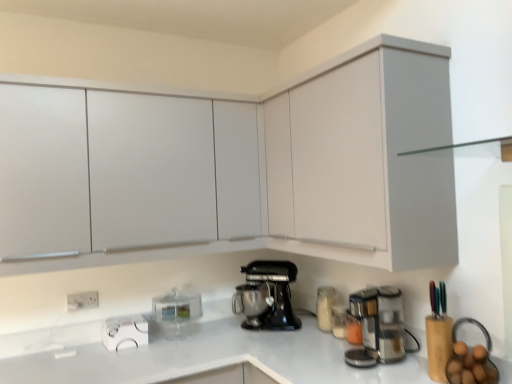
What do you see at coordinates (82, 300) in the screenshot? I see `white plastic electric outlet at lower left` at bounding box center [82, 300].

The height and width of the screenshot is (384, 512). Describe the element at coordinates (119, 175) in the screenshot. I see `white matte cabinet at upper left, the first cabinetry from the back` at that location.

What is the approximate width of black matte stand mixer at center, which ranks as the second kitchen appliance in left-to-right order?

It is 12.92 inches.

This screenshot has width=512, height=384. I want to click on stainless steel coffee maker at lower right, so click(380, 327).

What is the approximate width of white matte cabinet at upper right, which is counted as the 2th cabinetry, starting from the back?

white matte cabinet at upper right, which is counted as the 2th cabinetry, starting from the back, is 14.37 inches in width.

Where is `white matte cabinet at upper right, which is counted as the 2th cabinetry, starting from the back`? white matte cabinet at upper right, which is counted as the 2th cabinetry, starting from the back is located at coordinates (371, 154).

This screenshot has height=384, width=512. In order to click on matte white cabinet at upper center, which appears as the 1th cabinetry when viewed from the front in this screenshot , I will do `click(240, 169)`.

In the scene shown: Is stainless steel coffee maker at lower right positioned with its back to matte white cabinet at upper center, which appears as the 1th cabinetry when viewed from the front?

No, matte white cabinet at upper center, which appears as the 1th cabinetry when viewed from the front, is not at the back of stainless steel coffee maker at lower right.

In the scene shown: Which object is further away from the camera, stainless steel coffee maker at lower right or matte white cabinet at upper center, which is the 3th cabinetry from back to front?

stainless steel coffee maker at lower right.

Can you tell me how much stainless steel coffee maker at lower right and matte white cabinet at upper center, which appears as the 1th cabinetry when viewed from the front, differ in facing direction?

There is a 91.8-degree angle between the facing directions of stainless steel coffee maker at lower right and matte white cabinet at upper center, which appears as the 1th cabinetry when viewed from the front.

Is white matte cabinet at upper right, the second cabinetry when ordered from front to back, positioned with its back to white plastic electric outlet at lower left?

No, white matte cabinet at upper right, the second cabinetry when ordered from front to back, is not facing the opposite direction of white plastic electric outlet at lower left.

From a real-world perspective, is white matte cabinet at upper right, which is counted as the 2th cabinetry, starting from the back, on top of white plastic electric outlet at lower left?

Indeed, from a real-world perspective, white matte cabinet at upper right, which is counted as the 2th cabinetry, starting from the back, stands above white plastic electric outlet at lower left.

From the picture: Considering the sizes of objects white matte cabinet at upper right, the second cabinetry when ordered from front to back, and white plastic electric outlet at lower left in the image provided, who is smaller, white matte cabinet at upper right, the second cabinetry when ordered from front to back, or white plastic electric outlet at lower left?

With smaller size is white plastic electric outlet at lower left.

From the image's perspective, is white matte cabinet at upper right, the second cabinetry when ordered from front to back, positioned above or below white plastic electric outlet at lower left?

white matte cabinet at upper right, the second cabinetry when ordered from front to back, is situated higher than white plastic electric outlet at lower left in the image.

Consider the image. Is matte white cabinet at upper center, which is the 3th cabinetry from back to front, not inside white matte cabinet at upper left, which is counted as the third cabinetry, starting from the front?

matte white cabinet at upper center, which is the 3th cabinetry from back to front, lies outside white matte cabinet at upper left, which is counted as the third cabinetry, starting from the front,'s area.

From a real-world perspective, is matte white cabinet at upper center, which appears as the 1th cabinetry when viewed from the front, positioned above or below white matte cabinet at upper left, the first cabinetry from the back?

matte white cabinet at upper center, which appears as the 1th cabinetry when viewed from the front, is situated higher than white matte cabinet at upper left, the first cabinetry from the back, in the real world.

From their relative heights in the image, would you say matte white cabinet at upper center, which is the 3th cabinetry from back to front, is taller or shorter than white matte cabinet at upper left, which is counted as the third cabinetry, starting from the front?

matte white cabinet at upper center, which is the 3th cabinetry from back to front, is taller than white matte cabinet at upper left, which is counted as the third cabinetry, starting from the front.

Is white plastic electric outlet at lower left far from white matte cabinet at upper left, the first cabinetry from the back?

That's not correct — white plastic electric outlet at lower left is a little close to white matte cabinet at upper left, the first cabinetry from the back.

Who is bigger, white plastic electric outlet at lower left or white matte cabinet at upper left, which is counted as the third cabinetry, starting from the front?

With larger size is white matte cabinet at upper left, which is counted as the third cabinetry, starting from the front.

Which of these two, white plastic electric outlet at lower left or white matte cabinet at upper left, the first cabinetry from the back, stands taller?

Standing taller between the two is white matte cabinet at upper left, the first cabinetry from the back.

Is white plastic electric outlet at lower left facing towards white matte cabinet at upper left, the first cabinetry from the back?

No, white plastic electric outlet at lower left is not aimed at white matte cabinet at upper left, the first cabinetry from the back.

Between point (394, 314) and point (257, 296), which one is positioned behind?

The point (257, 296) is farther.

Which of these two, stainless steel coffee maker at lower right or black matte stand mixer at center, the first kitchen appliance viewed from the right, is thinner?

Thinner between the two is stainless steel coffee maker at lower right.

Would you say stainless steel coffee maker at lower right is outside black matte stand mixer at center, the first kitchen appliance viewed from the right?

That's correct, stainless steel coffee maker at lower right is outside of black matte stand mixer at center, the first kitchen appliance viewed from the right.

Are white matte cabinet at upper right, the second cabinetry when ordered from front to back, and black matte stand mixer at center, the first kitchen appliance viewed from the right, far apart?

No, white matte cabinet at upper right, the second cabinetry when ordered from front to back, is not far away from black matte stand mixer at center, the first kitchen appliance viewed from the right.

Who is more distant, white matte cabinet at upper right, the second cabinetry when ordered from front to back, or black matte stand mixer at center, which ranks as the second kitchen appliance in left-to-right order?

black matte stand mixer at center, which ranks as the second kitchen appliance in left-to-right order.

From the image's perspective, between white matte cabinet at upper right, the second cabinetry when ordered from front to back, and black matte stand mixer at center, which ranks as the second kitchen appliance in left-to-right order, who is located below?

black matte stand mixer at center, which ranks as the second kitchen appliance in left-to-right order, appears lower in the image.

Do you think white matte cabinet at upper right, the second cabinetry when ordered from front to back, is within black matte stand mixer at center, which ranks as the second kitchen appliance in left-to-right order, or outside of it?

white matte cabinet at upper right, the second cabinetry when ordered from front to back, cannot be found inside black matte stand mixer at center, which ranks as the second kitchen appliance in left-to-right order.

Which of these two, white plastic electric outlet at lower left or matte white cabinet at upper center, which is the 3th cabinetry from back to front, is bigger?

matte white cabinet at upper center, which is the 3th cabinetry from back to front, is bigger.

How many degrees apart are the facing directions of white plastic electric outlet at lower left and matte white cabinet at upper center, which appears as the 1th cabinetry when viewed from the front?

The facing directions of white plastic electric outlet at lower left and matte white cabinet at upper center, which appears as the 1th cabinetry when viewed from the front, are 0.145 degrees apart.

Is white plastic electric outlet at lower left aimed at matte white cabinet at upper center, which is the 3th cabinetry from back to front?

No, white plastic electric outlet at lower left is not facing towards matte white cabinet at upper center, which is the 3th cabinetry from back to front.

Is white plastic electric outlet at lower left shorter than matte white cabinet at upper center, which appears as the 1th cabinetry when viewed from the front?

Yes, white plastic electric outlet at lower left is shorter than matte white cabinet at upper center, which appears as the 1th cabinetry when viewed from the front.

Find the location of a particular element. The height and width of the screenshot is (384, 512). home appliance on the right of the matte white cabinet at upper center, which is the 3th cabinetry from back to front is located at coordinates (380, 327).

Image resolution: width=512 pixels, height=384 pixels. I want to click on the 2nd cabinetry in front of the white plastic electric outlet at lower left, counting from the anchor's position, so click(371, 154).

Which object lies further to the anchor point transparent plastic container at center, which is the first kitchen appliance from left to right, white matte cabinet at upper left, the first cabinetry from the back, or white matte cabinet at upper right, which is counted as the 2th cabinetry, starting from the back?

Among the two, white matte cabinet at upper right, which is counted as the 2th cabinetry, starting from the back, is located further to transparent plastic container at center, which is the first kitchen appliance from left to right.

Estimate the real-world distances between objects in this image. Which object is further from white plastic electric outlet at lower left, white matte cabinet at upper right, which is counted as the 2th cabinetry, starting from the back, or black matte stand mixer at center, which ranks as the second kitchen appliance in left-to-right order?

white matte cabinet at upper right, which is counted as the 2th cabinetry, starting from the back, is positioned further to the anchor white plastic electric outlet at lower left.

Which object lies nearer to the anchor point stainless steel coffee maker at lower right, white matte cabinet at upper right, which is counted as the 2th cabinetry, starting from the back, or black matte stand mixer at center, the first kitchen appliance viewed from the right?

black matte stand mixer at center, the first kitchen appliance viewed from the right.

Based on the photo, when comparing their distances from transparent plastic container at center, which is the first kitchen appliance from left to right, does stainless steel coffee maker at lower right or white glossy kettle at lower left seem closer?

The object closer to transparent plastic container at center, which is the first kitchen appliance from left to right, is white glossy kettle at lower left.

From the image, which object appears to be nearer to black matte stand mixer at center, the first kitchen appliance viewed from the right, white plastic electric outlet at lower left or white matte cabinet at upper right, which is counted as the 2th cabinetry, starting from the back?

white matte cabinet at upper right, which is counted as the 2th cabinetry, starting from the back, is positioned closer to the anchor black matte stand mixer at center, the first kitchen appliance viewed from the right.

Considering their positions, is white matte cabinet at upper right, the second cabinetry when ordered from front to back, positioned closer to transparent plastic container at center, positioned as the 2th kitchen appliance in right-to-left order, than matte white cabinet at upper center, which appears as the 1th cabinetry when viewed from the front?

Based on the image, matte white cabinet at upper center, which appears as the 1th cabinetry when viewed from the front, appears to be nearer to transparent plastic container at center, positioned as the 2th kitchen appliance in right-to-left order.

Looking at this image, based on their spatial positions, is matte white cabinet at upper center, which is the 3th cabinetry from back to front, or black matte stand mixer at center, the first kitchen appliance viewed from the right, closer to white matte cabinet at upper left, which is counted as the third cabinetry, starting from the front?

matte white cabinet at upper center, which is the 3th cabinetry from back to front, is closer to white matte cabinet at upper left, which is counted as the third cabinetry, starting from the front.

Considering their positions, is white matte cabinet at upper left, the first cabinetry from the back, positioned further to white plastic electric outlet at lower left than stainless steel coffee maker at lower right?

stainless steel coffee maker at lower right lies further to white plastic electric outlet at lower left than the other object.

Identify the location of appliance between white plastic electric outlet at lower left and stainless steel coffee maker at lower right from left to right. (125, 332).

The height and width of the screenshot is (384, 512). I want to click on home appliance between matte white cabinet at upper center, which is the 3th cabinetry from back to front, and white glossy kettle at lower left in the front-back direction, so click(380, 327).

Locate an element on the screen. The width and height of the screenshot is (512, 384). kitchen appliance located between transparent plastic container at center, which is the first kitchen appliance from left to right, and stainless steel coffee maker at lower right in the left-right direction is located at coordinates (267, 296).

The image size is (512, 384). Find the location of `appliance located between white plastic electric outlet at lower left and white matte cabinet at upper right, the second cabinetry when ordered from front to back, in the left-right direction`. appliance located between white plastic electric outlet at lower left and white matte cabinet at upper right, the second cabinetry when ordered from front to back, in the left-right direction is located at coordinates (125, 332).